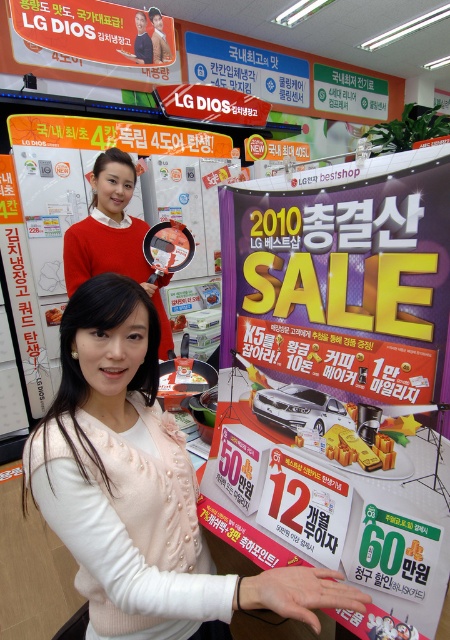
Is pearl white sweater at center positioned behind matte red sweater at upper left?

No, pearl white sweater at center is closer to the viewer.

Does point (31, 451) come behind point (99, 198)?

No, (31, 451) is in front of (99, 198).

Find the location of a particular element. The height and width of the screenshot is (640, 450). pearl white sweater at center is located at coordinates (140, 488).